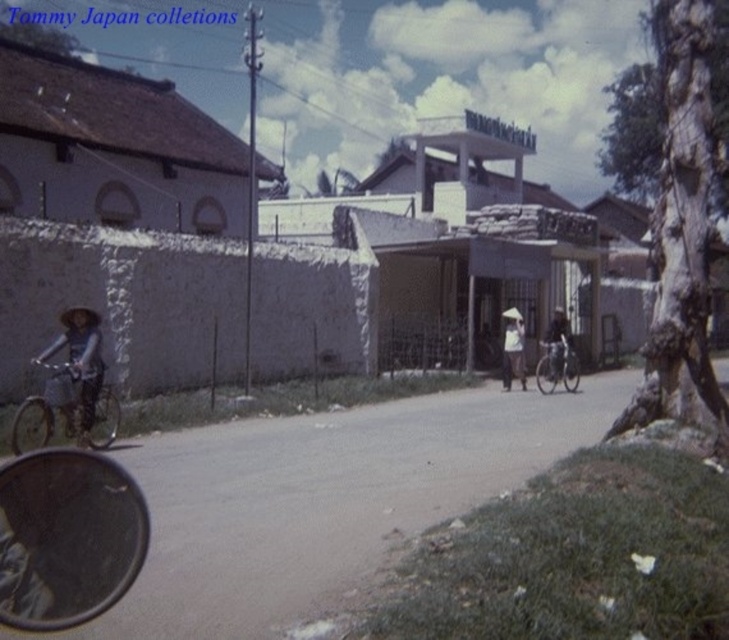
Question: Considering the relative positions of matte gray bicycle at left and metallic silver bicycle at center-right in the image provided, where is matte gray bicycle at left located with respect to metallic silver bicycle at center-right?

Choices:
 (A) right
 (B) left

Answer: (B)

Question: From the image, what is the correct spatial relationship of metallic silver bicycle at left in relation to matte gray bicycle at left?

Choices:
 (A) right
 (B) left

Answer: (B)

Question: Which object is the closest to the matte gray bicycle at left?

Choices:
 (A) metallic silver bicycle at left
 (B) white cloth hat at center
 (C) metallic silver bicycle at center-right

Answer: (A)

Question: Observing the image, what is the correct spatial positioning of matte gray bicycle at left in reference to metallic silver bicycle at center-right?

Choices:
 (A) right
 (B) left

Answer: (B)

Question: Which of the following is the farthest from the observer?

Choices:
 (A) metallic silver bicycle at left
 (B) metallic silver bicycle at center-right
 (C) matte gray bicycle at left

Answer: (B)

Question: Which is farther from the metallic silver bicycle at center-right?

Choices:
 (A) white cloth hat at center
 (B) matte gray bicycle at left
 (C) metallic silver bicycle at left

Answer: (B)